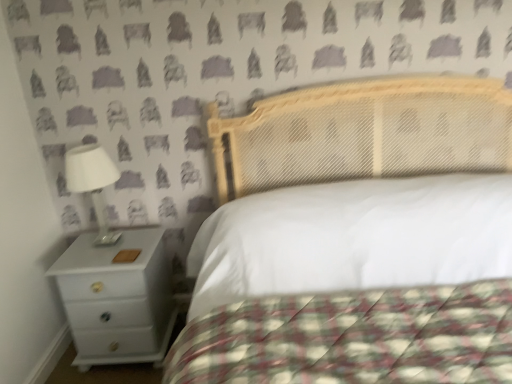
Find the location of a particular element. unoccupied region to the right of white glossy lamp at left is located at coordinates (143, 238).